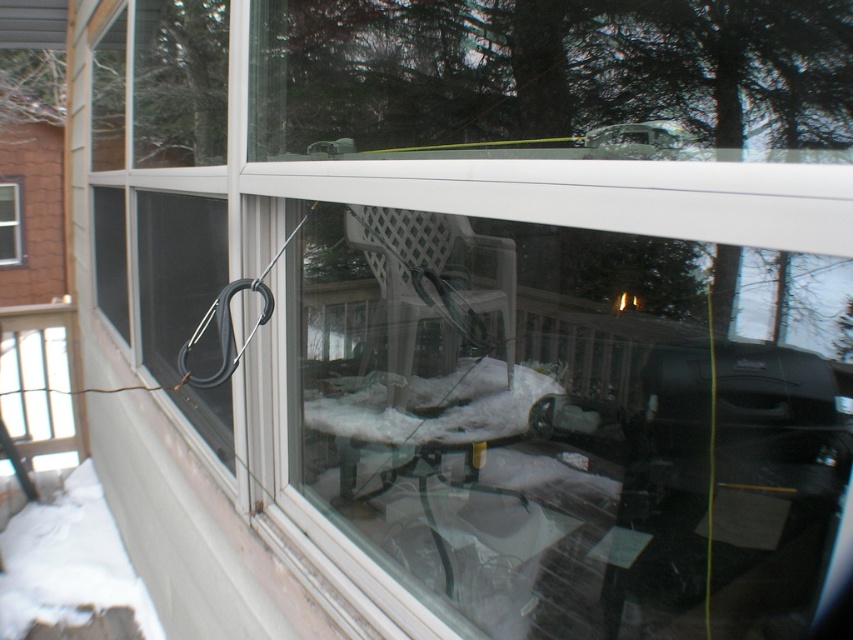
In the scene shown: Does white plastic porch at lower left appear on the left side of clear glass window at upper left?

No, white plastic porch at lower left is not to the left of clear glass window at upper left.

Can you confirm if white plastic porch at lower left is shorter than clear glass window at upper left?

Yes.

Image resolution: width=853 pixels, height=640 pixels. I want to click on white plastic porch at lower left, so click(38, 378).

Locate an element on the screen. Image resolution: width=853 pixels, height=640 pixels. white plastic porch at lower left is located at coordinates (38, 378).

Which is above, white powdery snow at lower left or white plastic porch at lower left?

white plastic porch at lower left is higher up.

Between white powdery snow at lower left and white plastic porch at lower left, which one has less height?

With less height is white powdery snow at lower left.

Does point (88, 618) come in front of point (67, 360)?

Yes.

The width and height of the screenshot is (853, 640). In order to click on white powdery snow at lower left in this screenshot , I will do `click(71, 570)`.

From the picture: Is white powdery snow at lower left thinner than clear glass window at upper left?

No, white powdery snow at lower left is not thinner than clear glass window at upper left.

Can you confirm if white powdery snow at lower left is wider than clear glass window at upper left?

Indeed, white powdery snow at lower left has a greater width compared to clear glass window at upper left.

This screenshot has height=640, width=853. What are the coordinates of `white powdery snow at lower left` in the screenshot? It's located at (71, 570).

Identify the location of white powdery snow at lower left. (71, 570).